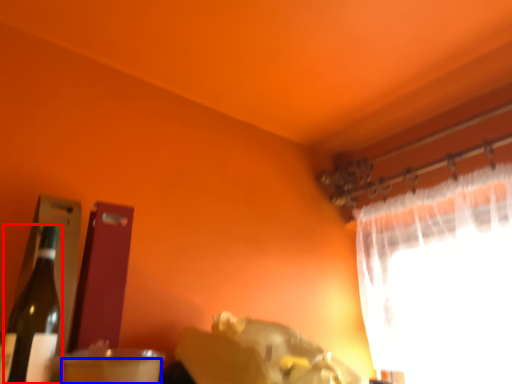
Question: Among these objects, which one is farthest to the camera, bottle (highlighted by a red box) or drinking straw (highlighted by a blue box)?

Choices:
 (A) bottle
 (B) drinking straw

Answer: (A)